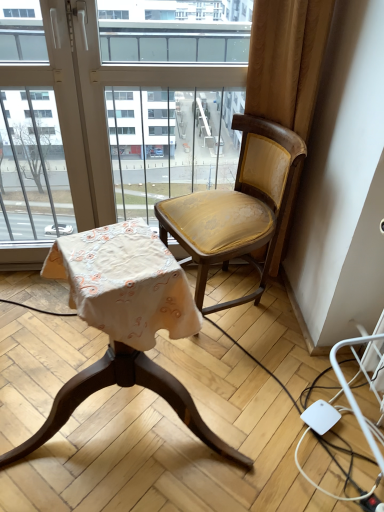
Question: Would you say matte gold fabric chair at right, the second chair when ordered from left to right, is to the left or to the right of transparent glass window at upper center in the picture?

Choices:
 (A) right
 (B) left

Answer: (A)

Question: From a real-world perspective, relative to transparent glass window at upper center, is matte gold fabric chair at right, the second chair when ordered from left to right, vertically above or below?

Choices:
 (A) below
 (B) above

Answer: (A)

Question: Which is nearer to the transparent glass window at upper center?

Choices:
 (A) matte gold fabric chair at center, placed as the 1th chair when sorted from left to right
 (B) matte gold fabric chair at right, the second chair when ordered from left to right

Answer: (B)

Question: Which object is the farthest from the matte gold fabric chair at right, the second chair when ordered from left to right?

Choices:
 (A) matte gold fabric chair at center, placed as the 1th chair when sorted from left to right
 (B) transparent glass window at upper center

Answer: (A)